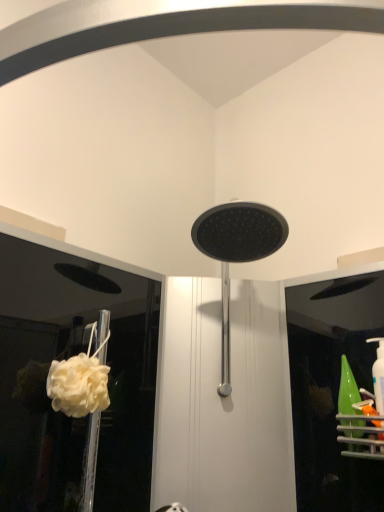
Question: Does point (261, 203) appear closer or farther from the camera than point (54, 377)?

Choices:
 (A) farther
 (B) closer

Answer: (A)

Question: Looking at their shapes, would you say matte black showerhead at center is wider or thinner than white fluffy sponge at lower left?

Choices:
 (A) thin
 (B) wide

Answer: (B)

Question: In the image, is matte black showerhead at center on the left side or the right side of white fluffy sponge at lower left?

Choices:
 (A) left
 (B) right

Answer: (B)

Question: Considering the positions of white fluffy sponge at lower left and matte black showerhead at center in the image, is white fluffy sponge at lower left taller or shorter than matte black showerhead at center?

Choices:
 (A) tall
 (B) short

Answer: (B)

Question: From a real-world perspective, is white fluffy sponge at lower left above or below matte black showerhead at center?

Choices:
 (A) above
 (B) below

Answer: (B)

Question: Looking at their shapes, would you say white fluffy sponge at lower left is wider or thinner than matte black showerhead at center?

Choices:
 (A) wide
 (B) thin

Answer: (B)

Question: Is white fluffy sponge at lower left in front of or behind matte black showerhead at center in the image?

Choices:
 (A) front
 (B) behind

Answer: (B)